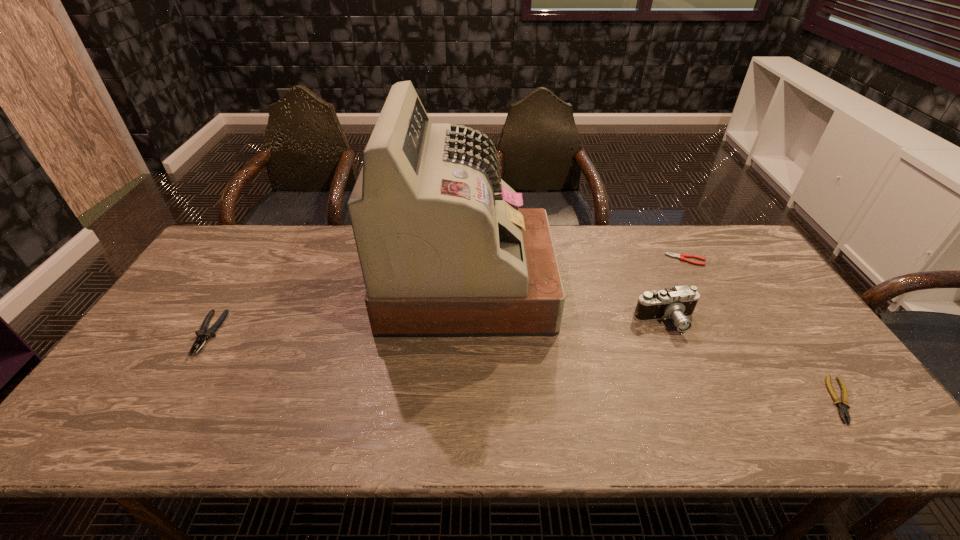
Locate an element on the screen. object that is positioned at the near right corner is located at coordinates (842, 404).

Find the location of a particular element. This screenshot has width=960, height=540. vacant point at the far edge is located at coordinates (325, 262).

In the image, there is a desktop. Where is `vacant space at the near edge`? The width and height of the screenshot is (960, 540). vacant space at the near edge is located at coordinates (559, 433).

At what (x,y) coordinates should I click in order to perform the action: click on blank space at the left edge of the desktop. Please return your answer as a coordinate pair (x, y). The image size is (960, 540). Looking at the image, I should click on (205, 302).

At what (x,y) coordinates should I click in order to perform the action: click on vacant space at the right edge. Please return your answer as a coordinate pair (x, y). The height and width of the screenshot is (540, 960). Looking at the image, I should click on pyautogui.click(x=835, y=381).

The image size is (960, 540). Find the location of `free spot at the far left corner of the desktop`. free spot at the far left corner of the desktop is located at coordinates (227, 262).

At what (x,y) coordinates should I click in order to perform the action: click on vacant region at the far right corner of the desktop. Please return your answer as a coordinate pair (x, y). The image size is (960, 540). Looking at the image, I should click on (730, 230).

Where is `free area in between the cash register and the third object from right to left`? free area in between the cash register and the third object from right to left is located at coordinates (566, 303).

Locate an element on the screen. This screenshot has height=540, width=960. free space between the third shortest object and the nearest object is located at coordinates (524, 367).

Where is `vacant space that's between the nearest pliers and the tallest object`? The image size is (960, 540). vacant space that's between the nearest pliers and the tallest object is located at coordinates (654, 342).